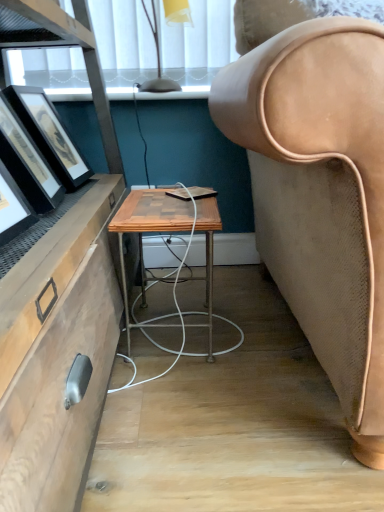
Question: Should I look upward or downward to see translucent yellow glass lampshade at upper center?

Choices:
 (A) up
 (B) down

Answer: (A)

Question: Is wooden/matte desk at center in contact with matte black picture frame at left?

Choices:
 (A) no
 (B) yes

Answer: (A)

Question: Is wooden/matte desk at center turned away from matte black picture frame at left?

Choices:
 (A) no
 (B) yes

Answer: (A)

Question: From the image's perspective, is wooden/matte desk at center on matte black picture frame at left?

Choices:
 (A) yes
 (B) no

Answer: (B)

Question: Could you tell me if wooden/matte desk at center is turned towards matte black picture frame at left?

Choices:
 (A) no
 (B) yes

Answer: (A)

Question: From a real-world perspective, is wooden/matte desk at center positioned over matte black picture frame at left based on gravity?

Choices:
 (A) yes
 (B) no

Answer: (B)

Question: Is wooden/matte desk at center wider than matte black picture frame at left?

Choices:
 (A) no
 (B) yes

Answer: (B)

Question: Is translucent yellow glass lampshade at upper center looking in the opposite direction of wooden/matte desk at center?

Choices:
 (A) yes
 (B) no

Answer: (B)

Question: From a real-world perspective, is translucent yellow glass lampshade at upper center over wooden/matte desk at center?

Choices:
 (A) no
 (B) yes

Answer: (B)

Question: Are translucent yellow glass lampshade at upper center and wooden/matte desk at center making contact?

Choices:
 (A) no
 (B) yes

Answer: (A)

Question: Can you confirm if translucent yellow glass lampshade at upper center is wider than wooden/matte desk at center?

Choices:
 (A) yes
 (B) no

Answer: (B)

Question: Does translucent yellow glass lampshade at upper center have a smaller size compared to wooden/matte desk at center?

Choices:
 (A) no
 (B) yes

Answer: (B)

Question: From the image's perspective, is translucent yellow glass lampshade at upper center above wooden/matte desk at center?

Choices:
 (A) no
 (B) yes

Answer: (B)

Question: Can you confirm if wooden/matte desk at center is smaller than translucent yellow glass lampshade at upper center?

Choices:
 (A) no
 (B) yes

Answer: (A)